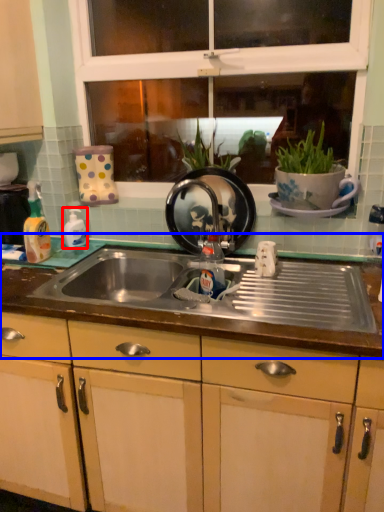
Question: Among these objects, which one is farthest to the camera, bottle (highlighted by a red box) or countertop (highlighted by a blue box)?

Choices:
 (A) bottle
 (B) countertop

Answer: (A)